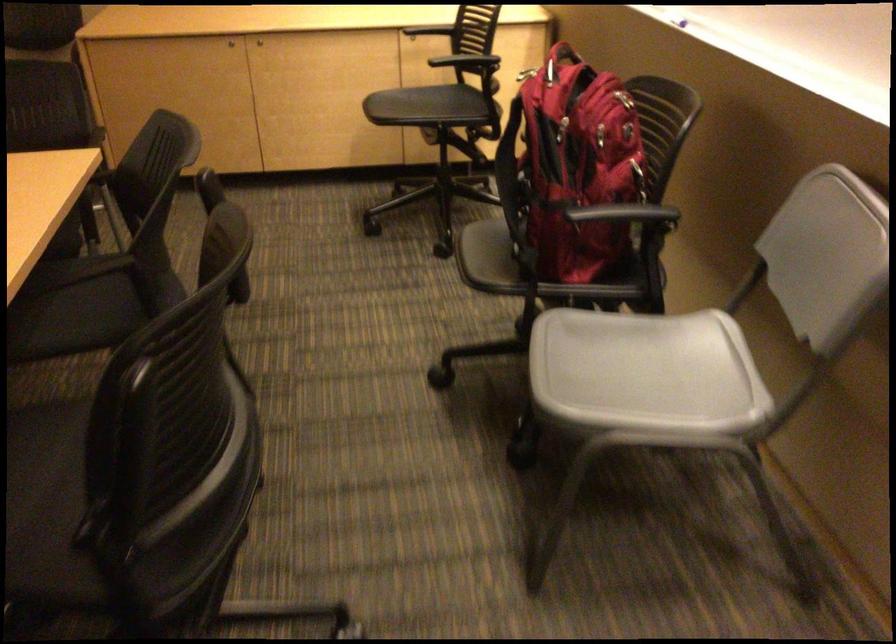
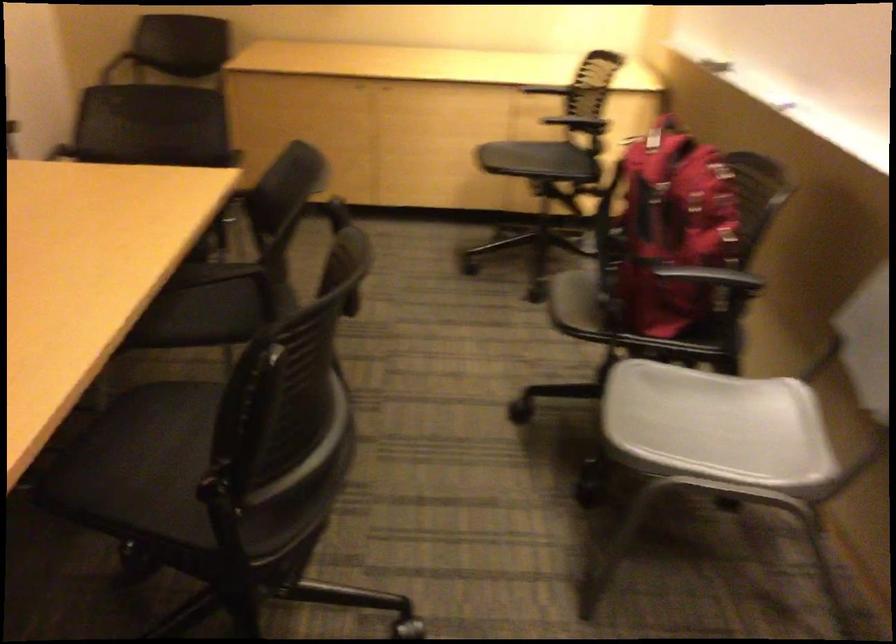
Question: The images are taken continuously from a first-person perspective. In which direction is your viewpoint rotating?

Choices:
 (A) Left
 (B) Right
 (C) Up
 (D) Down

Answer: (A)